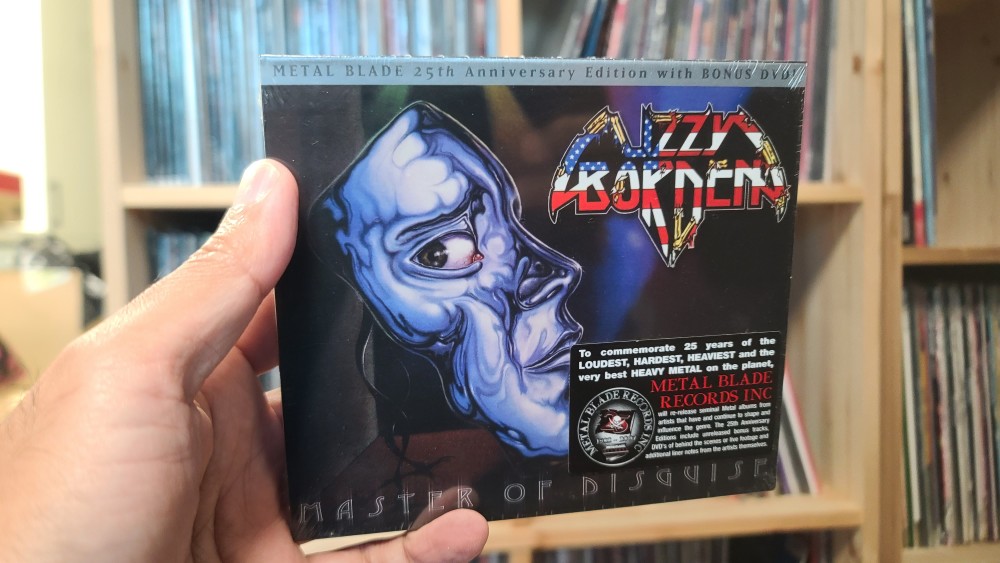
This screenshot has width=1000, height=563. What are the coordinates of `window` in the screenshot? It's located at (23, 119).